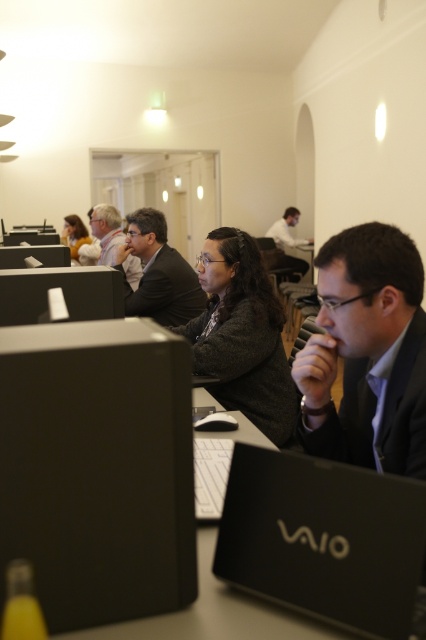
Between point (187, 490) and point (71, 253), which one is positioned behind?

The point (71, 253) is behind.

Does point (94, 452) come farther from viewer compared to point (74, 243)?

No.

The width and height of the screenshot is (426, 640). Describe the element at coordinates (97, 468) in the screenshot. I see `black plastic computer at center` at that location.

Image resolution: width=426 pixels, height=640 pixels. I want to click on black plastic computer at center, so click(x=97, y=468).

Can you confirm if dark gray suit at center is smaller than matte gray suit at center?

Indeed, dark gray suit at center has a smaller size compared to matte gray suit at center.

Is dark gray suit at center thinner than matte gray suit at center?

In fact, dark gray suit at center might be wider than matte gray suit at center.

Where is `dark gray suit at center`? The height and width of the screenshot is (640, 426). dark gray suit at center is located at coordinates (158, 273).

From the picture: Which of these two, black plastic computer at center or black matte laptop at center, stands shorter?

Standing shorter between the two is black matte laptop at center.

Does black plastic computer at center lie in front of black matte laptop at center?

Yes, it is in front of black matte laptop at center.

Which is in front, point (112, 582) or point (328, 536)?

Positioned in front is point (112, 582).

Find the location of `black plastic computer at center`. black plastic computer at center is located at coordinates (97, 468).